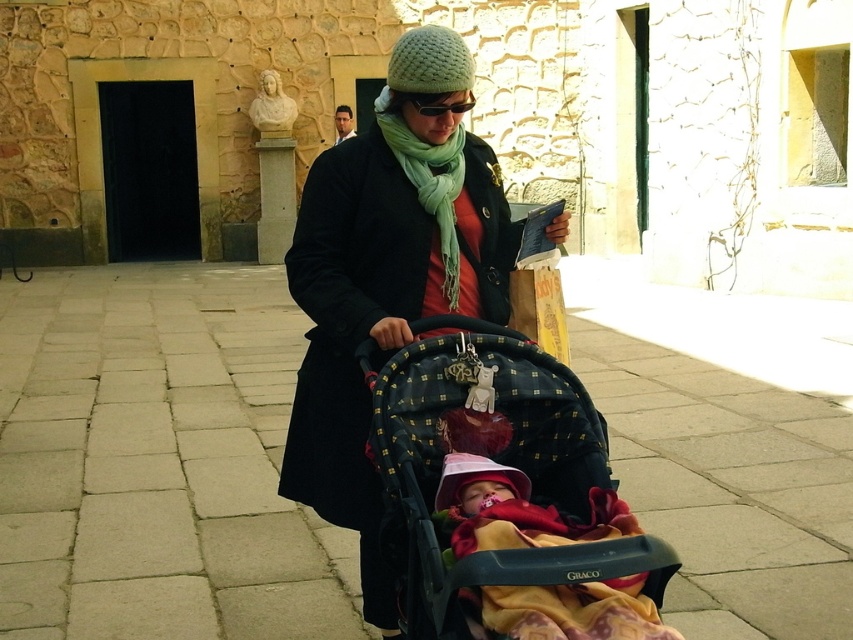
Question: Is green knitted scarf at center smaller than knitted green hat at upper center?

Choices:
 (A) yes
 (B) no

Answer: (B)

Question: Can you confirm if soft pink fabric at center is bigger than green knitted scarf at center?

Choices:
 (A) yes
 (B) no

Answer: (A)

Question: Observing the image, what is the correct spatial positioning of paved stone pavement at center in reference to soft pink fabric at center?

Choices:
 (A) above
 (B) below

Answer: (A)

Question: Based on their relative distances, which object is farther from the soft pink fabric at center?

Choices:
 (A) black textured fabric baby carriage at center
 (B) knitted green hat at upper center
 (C) paved stone pavement at center

Answer: (C)

Question: Which is nearer to the soft pink fabric at center?

Choices:
 (A) matte black coat at center
 (B) knitted green hat at upper center
 (C) paved stone pavement at center
 (D) green knitted scarf at center

Answer: (A)

Question: Which object is closer to the camera taking this photo?

Choices:
 (A) knitted green hat at upper center
 (B) matte black coat at center
 (C) black textured fabric baby carriage at center

Answer: (C)